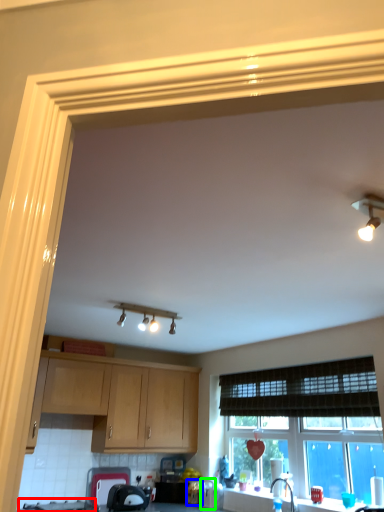
Question: Estimate the real-world distances between objects in this image. Which object is farther from gas stove (highlighted by a red box), appliance (highlighted by a blue box) or appliance (highlighted by a green box)?

Choices:
 (A) appliance
 (B) appliance

Answer: (B)